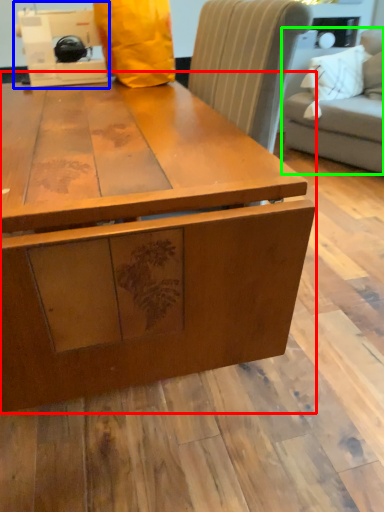
Question: Considering the real-world distances, which object is closest to table (highlighted by a red box)? sewing machine (highlighted by a blue box) or studio couch (highlighted by a green box).

Choices:
 (A) sewing machine
 (B) studio couch

Answer: (A)